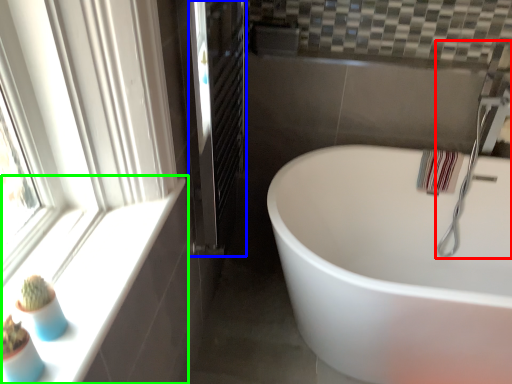
Question: Which is farther away from faucet (highlighted by a red box)? screen door (highlighted by a blue box) or window sill (highlighted by a green box)?

Choices:
 (A) screen door
 (B) window sill

Answer: (B)